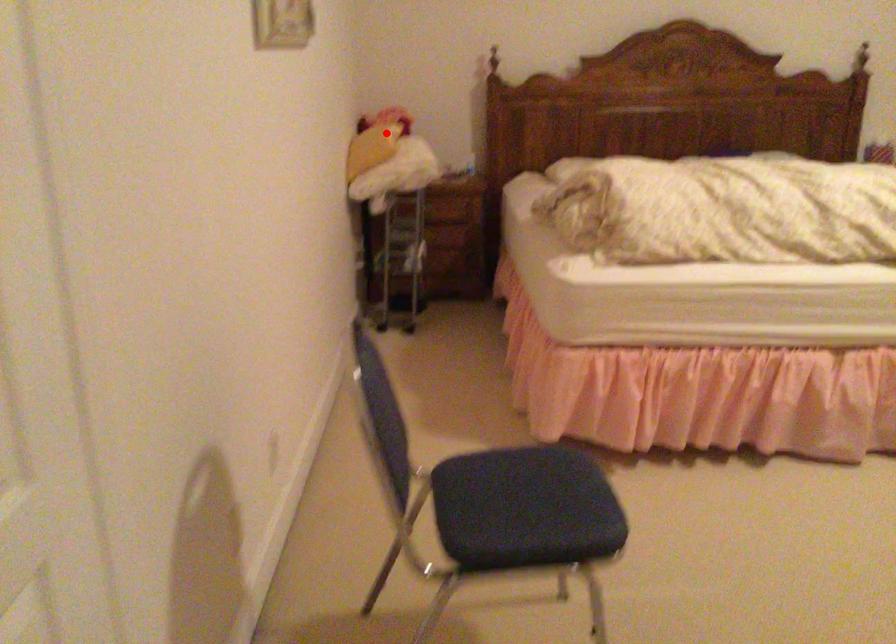
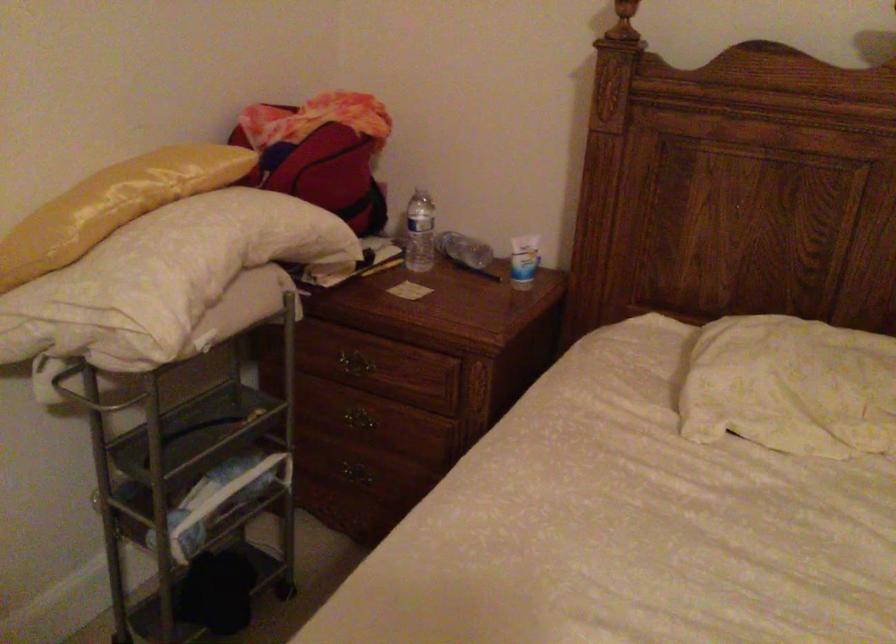
Question: I am providing you with two images of the same scene from different viewpoints. A red point is shown in image1. For the corresponding object point in image2, is it positioned nearer or farther from the camera?

Choices:
 (A) Nearer
 (B) Farther

Answer: (A)